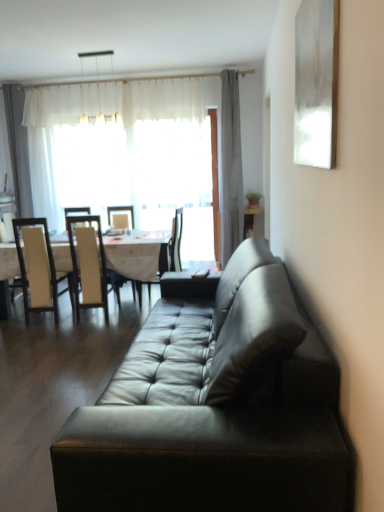
Question: Is leather couch at center positioned in front of gray fabric curtain at upper center?

Choices:
 (A) yes
 (B) no

Answer: (A)

Question: Considering the relative sizes of leather couch at center and gray fabric curtain at upper center in the image provided, is leather couch at center smaller than gray fabric curtain at upper center?

Choices:
 (A) yes
 (B) no

Answer: (B)

Question: Considering the relative sizes of leather couch at center and gray fabric curtain at upper center in the image provided, is leather couch at center thinner than gray fabric curtain at upper center?

Choices:
 (A) no
 (B) yes

Answer: (A)

Question: Is leather couch at center located outside gray fabric curtain at upper center?

Choices:
 (A) yes
 (B) no

Answer: (A)

Question: From the image's perspective, is leather couch at center located beneath gray fabric curtain at upper center?

Choices:
 (A) yes
 (B) no

Answer: (A)

Question: Is leather couch at center far from gray fabric curtain at upper center?

Choices:
 (A) no
 (B) yes

Answer: (B)

Question: Is leather couch at center positioned with its back to white leather chair at left, which ranks as the second chair in left-to-right order?

Choices:
 (A) yes
 (B) no

Answer: (B)

Question: Can you confirm if leather couch at center is smaller than white leather chair at left, which ranks as the second chair in left-to-right order?

Choices:
 (A) no
 (B) yes

Answer: (A)

Question: Could you tell me if leather couch at center is facing white leather chair at left, marked as the 2th chair in a right-to-left arrangement?

Choices:
 (A) yes
 (B) no

Answer: (B)

Question: Is leather couch at center located outside white leather chair at left, which ranks as the second chair in left-to-right order?

Choices:
 (A) yes
 (B) no

Answer: (A)

Question: Is leather couch at center positioned in front of white leather chair at left, marked as the 2th chair in a right-to-left arrangement?

Choices:
 (A) no
 (B) yes

Answer: (B)

Question: Is leather couch at center at the left side of white leather chair at left, which ranks as the second chair in left-to-right order?

Choices:
 (A) yes
 (B) no

Answer: (B)

Question: Is white sheer curtain at upper left far away from leather couch at center?

Choices:
 (A) no
 (B) yes

Answer: (B)